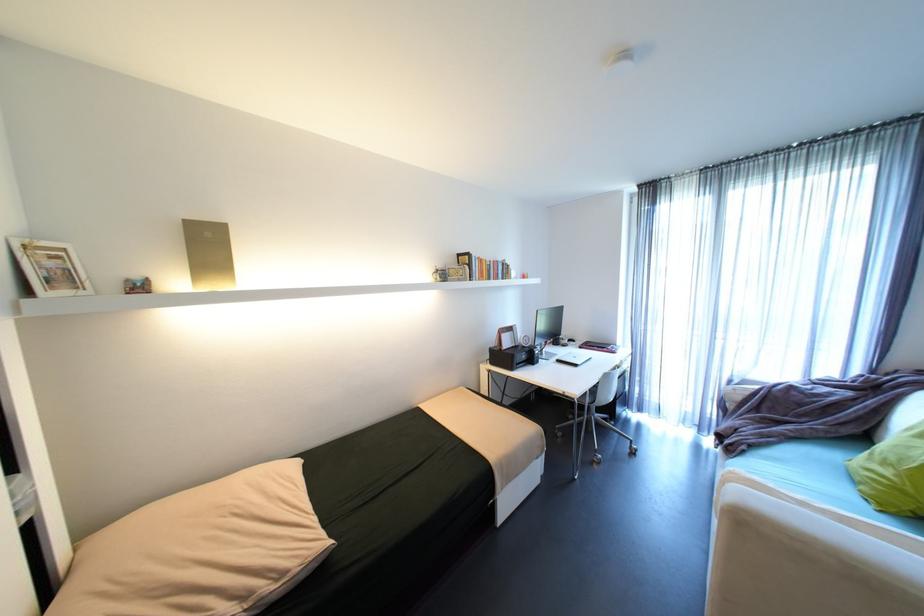
This screenshot has width=924, height=616. What do you see at coordinates (439, 274) in the screenshot?
I see `a white mug` at bounding box center [439, 274].